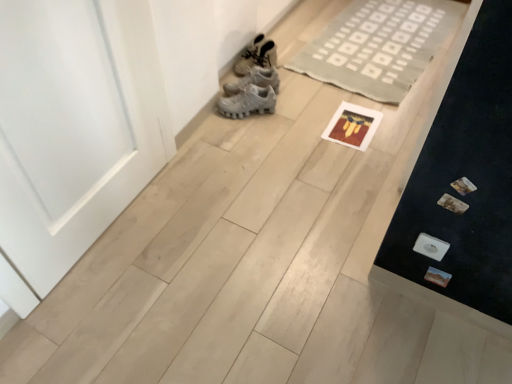
The width and height of the screenshot is (512, 384). In order to click on vacant location below neutral woven rug at upper center (from a real-world perspective) in this screenshot , I will do `click(374, 33)`.